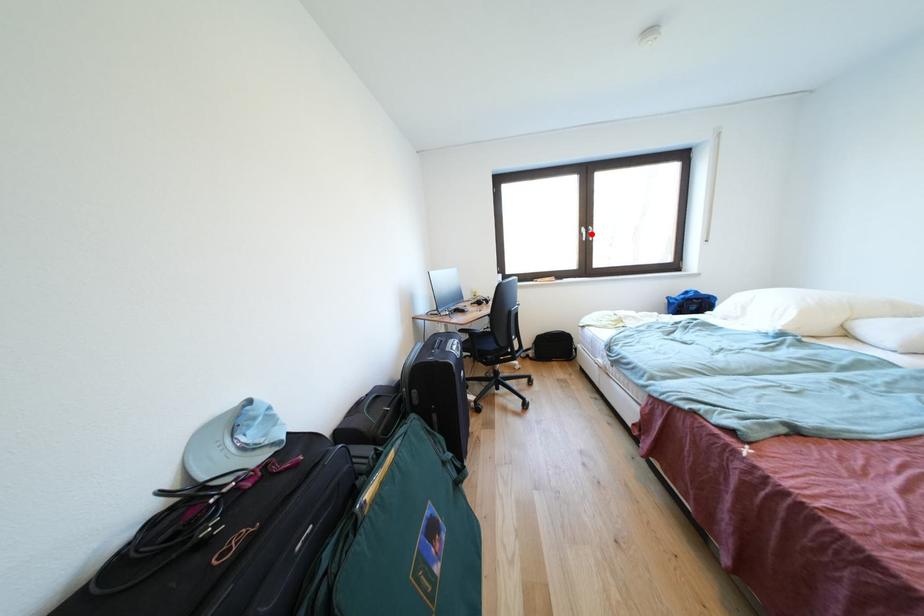
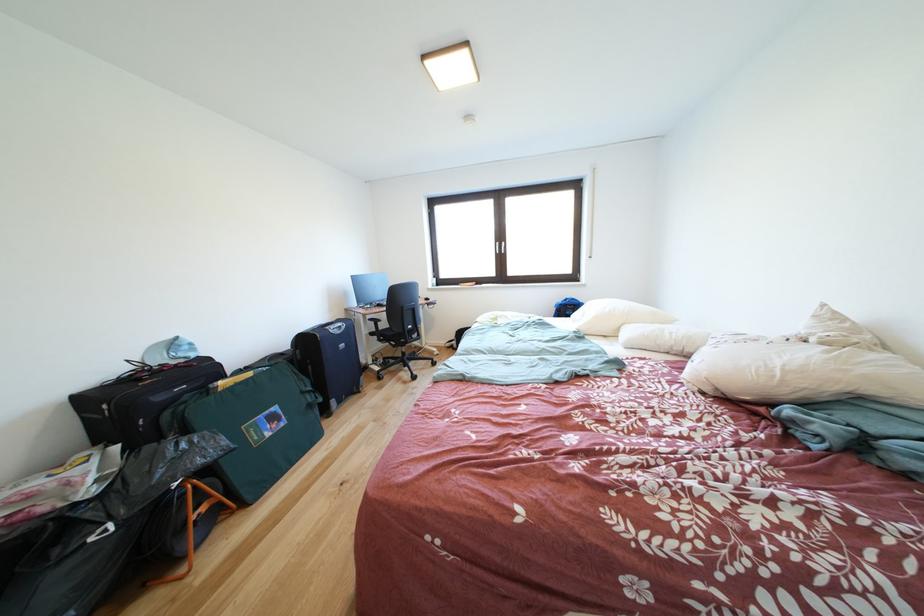
The point at the highlighted location is marked in the first image. Where is the corresponding point in the second image?

(505, 249)